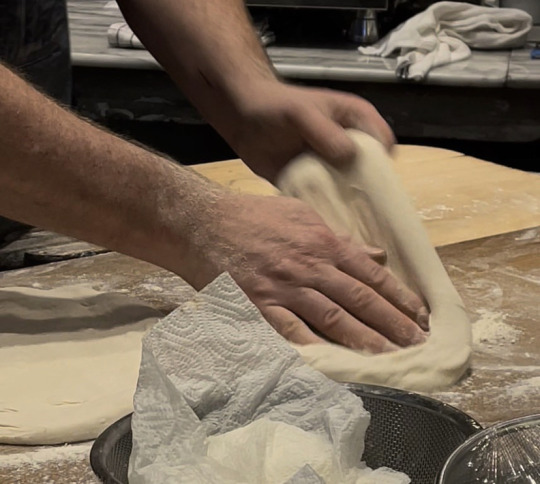
At what (x,y) coordinates should I click in order to perform the action: click on wood board. Please return your answer as a coordinate pair (x, y). This screenshot has height=484, width=540. Looking at the image, I should click on (510, 268), (114, 282).